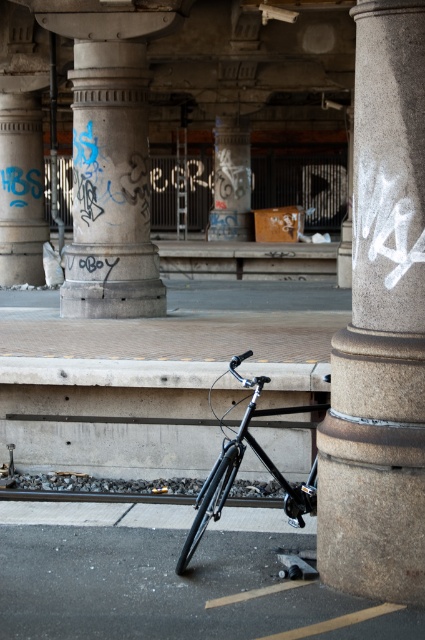
Question: Does black asphalt at lower center appear over concrete textured pillar at center?

Choices:
 (A) yes
 (B) no

Answer: (B)

Question: Which of these objects is positioned closest to the concrete textured pillar at center?

Choices:
 (A) smooth concrete pillar at center
 (B) black asphalt at lower center

Answer: (B)

Question: Does shiny black bicycle at center appear under smooth concrete pillar at center?

Choices:
 (A) no
 (B) yes

Answer: (B)

Question: Which object is the farthest from the shiny black bicycle at center?

Choices:
 (A) concrete textured pillar at center
 (B) granite column at center
 (C) smooth concrete pillar at center

Answer: (C)

Question: Is granite column at center bigger than black asphalt at lower center?

Choices:
 (A) yes
 (B) no

Answer: (A)

Question: Among these points, which one is nearest to the camera?

Choices:
 (A) (147, 577)
 (B) (362, 547)
 (C) (243, 168)

Answer: (B)